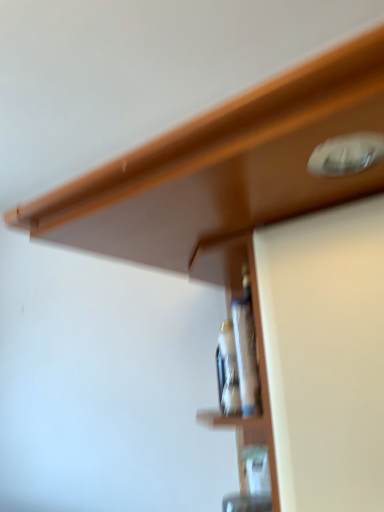
Question: Would you consider translucent glass bottle at center, the 1th bottle viewed from the back, to be distant from translucent glass bottle at center, acting as the second bottle starting from the back?

Choices:
 (A) yes
 (B) no

Answer: (B)

Question: Is translucent glass bottle at center, the 1th bottle viewed from the back, facing towards translucent glass bottle at center, the first bottle when ordered from front to back?

Choices:
 (A) no
 (B) yes

Answer: (A)

Question: Is translucent glass bottle at center, the 1th bottle viewed from the back, directly adjacent to translucent glass bottle at center, acting as the second bottle starting from the back?

Choices:
 (A) no
 (B) yes

Answer: (B)

Question: Would you say translucent glass bottle at center, the 1th bottle viewed from the back, contains translucent glass bottle at center, the first bottle when ordered from front to back?

Choices:
 (A) no
 (B) yes

Answer: (A)

Question: From a real-world perspective, is translucent glass bottle at center, the 2th bottle when ordered from front to back, located higher than translucent glass bottle at center, acting as the second bottle starting from the back?

Choices:
 (A) no
 (B) yes

Answer: (A)

Question: Is the position of translucent glass bottle at center, the 1th bottle viewed from the back, more distant than that of translucent glass bottle at center, acting as the second bottle starting from the back?

Choices:
 (A) no
 (B) yes

Answer: (B)

Question: From the image's perspective, is translucent glass bottle at center, the first bottle when ordered from front to back, under translucent glass bottle at center, the 1th bottle viewed from the back?

Choices:
 (A) yes
 (B) no

Answer: (B)

Question: Does translucent glass bottle at center, the first bottle when ordered from front to back, come behind translucent glass bottle at center, the 1th bottle viewed from the back?

Choices:
 (A) no
 (B) yes

Answer: (A)

Question: Is translucent glass bottle at center, the first bottle when ordered from front to back, not near translucent glass bottle at center, the 1th bottle viewed from the back?

Choices:
 (A) yes
 (B) no

Answer: (B)

Question: From a real-world perspective, is translucent glass bottle at center, acting as the second bottle starting from the back, physically below translucent glass bottle at center, the 1th bottle viewed from the back?

Choices:
 (A) no
 (B) yes

Answer: (A)

Question: Can you confirm if translucent glass bottle at center, acting as the second bottle starting from the back, is positioned to the right of translucent glass bottle at center, the 1th bottle viewed from the back?

Choices:
 (A) yes
 (B) no

Answer: (B)

Question: Is translucent glass bottle at center, the first bottle when ordered from front to back, to the left of translucent glass bottle at center, the 1th bottle viewed from the back, from the viewer's perspective?

Choices:
 (A) yes
 (B) no

Answer: (A)

Question: Considering the relative positions of translucent glass bottle at center, acting as the second bottle starting from the back, and translucent glass bottle at center, the 1th bottle viewed from the back, in the image provided, is translucent glass bottle at center, acting as the second bottle starting from the back, to the left or to the right of translucent glass bottle at center, the 1th bottle viewed from the back,?

Choices:
 (A) right
 (B) left

Answer: (B)